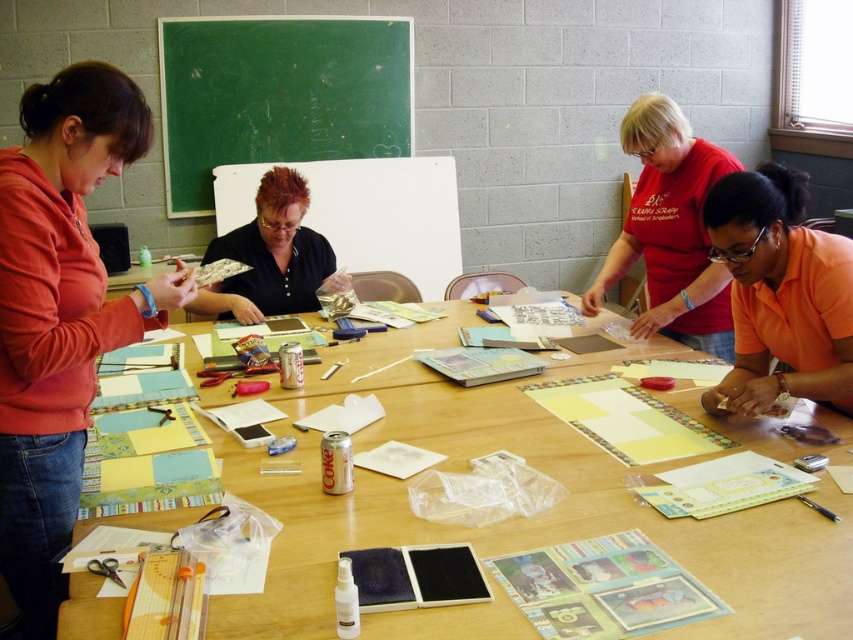
You are a photographer positioned in front of the green chalkboard at upper center and the shiny black shirt at center. You want to take a photo that captures both objects clearly. Which object should you focus on first to ensure both are in focus?

The shiny black shirt at center is behind the green chalkboard at upper center, so you should focus on the shiny black shirt at center first to ensure both are in focus.